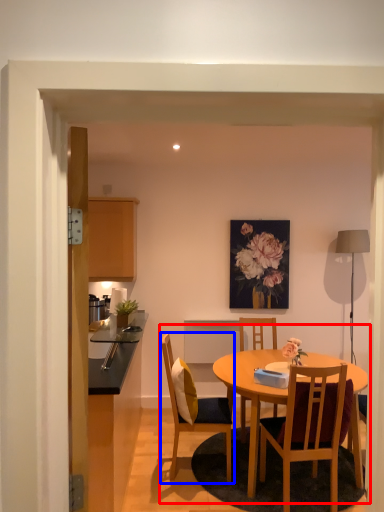
Question: Which of the following is the closest to the observer, kitchen & dining room table (highlighted by a red box) or chair (highlighted by a blue box)?

Choices:
 (A) kitchen & dining room table
 (B) chair

Answer: (A)